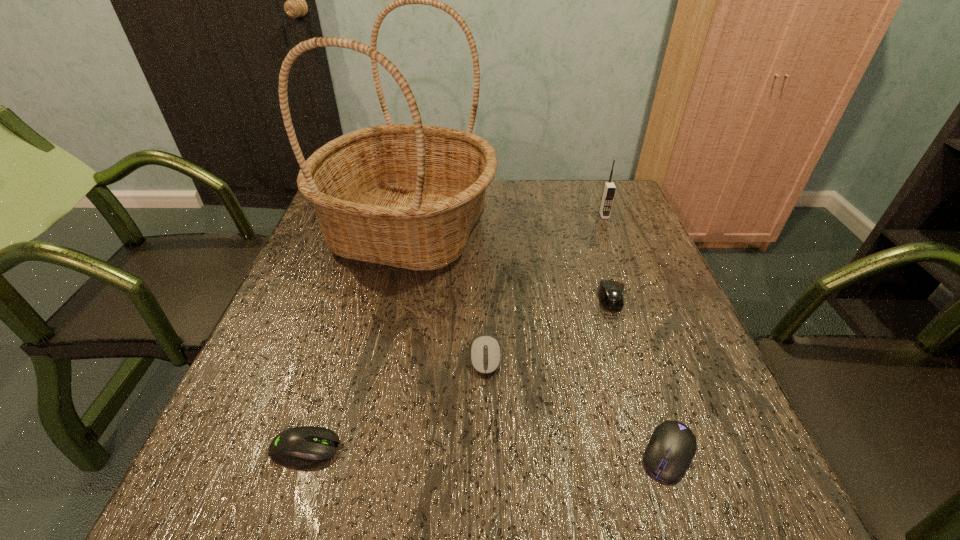
Find the location of a particular element. This screenshot has height=540, width=960. vacant space at the far edge is located at coordinates [x=565, y=211].

The height and width of the screenshot is (540, 960). In order to click on free space at the near edge of the desktop in this screenshot , I will do `click(495, 478)`.

Identify the location of free point at the left edge. (328, 334).

You are a GUI agent. You are given a task and a screenshot of the screen. Output one action in this format:
    pyautogui.click(x=<x>, y=<y>)
    Task: Click on the free point at the right edge
    
    Given the screenshot: What is the action you would take?
    657,396

I want to click on vacant area at the near left corner of the desktop, so click(256, 480).

At what (x,y) coordinates should I click in order to perform the action: click on vacant area that lies between the farthest computer mouse and the leftmost computer mouse. Please return your answer as a coordinate pair (x, y). Looking at the image, I should click on (458, 373).

Where is `free space that is in between the fifth shortest object and the tallest object`? free space that is in between the fifth shortest object and the tallest object is located at coordinates point(507,222).

The height and width of the screenshot is (540, 960). What are the coordinates of `free space between the tallest object and the leftmost computer mouse` in the screenshot? It's located at (357, 339).

I want to click on free point between the tallest object and the farthest computer mouse, so click(x=510, y=264).

Identify the location of vacant space in between the second tallest object and the leftmost computer mouse. The height and width of the screenshot is (540, 960). (455, 332).